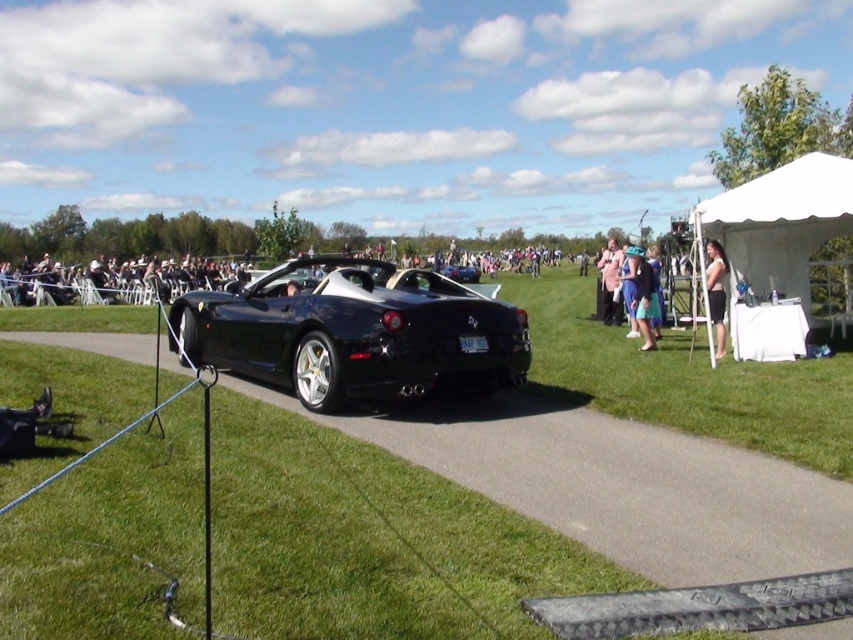
You are a photographer at the event and need to take a photo of the blue fabric dress at center without the white fabric tent at upper right appearing in the background. Is this possible given their positions?

The blue fabric dress at center is positioned under the white fabric tent at upper right, so the tent would be behind the dress in the photo, making it visible in the background.

You are standing at the camera position and want to reach the point labeled as point (x=735, y=253). However, there is an obstacle at point labeled as point (x=238, y=362). Will you encounter this obstacle before reaching your destination?

Yes, you will encounter the obstacle at point (x=238, y=362) before reaching point (x=735, y=253) because point (x=238, y=362) is closer to the camera than point (x=735, y=253).

You are standing at the point marked by the coordinates point (x=639, y=296) in the image. Looking around, you see a blue fabric dress at center and a white tent to the right of the car. Which direction should you walk to reach the white tent?

The point (x=639, y=296) is on the blue fabric dress at center. To reach the white tent to the right of the car, you should walk to the right from the blue fabric dress at center.